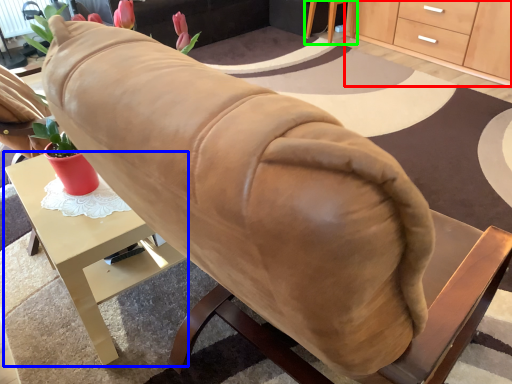
Question: Estimate the real-world distances between objects in this image. Which object is farther from cabinetry (highlighted by a red box), desk (highlighted by a blue box) or table (highlighted by a green box)?

Choices:
 (A) desk
 (B) table

Answer: (A)